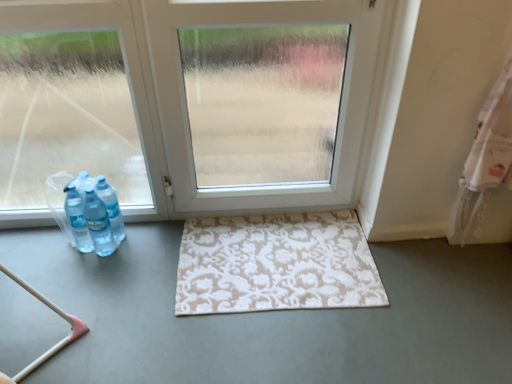
This screenshot has width=512, height=384. I want to click on vacant space to the right of beige patterned rug at center, so click(x=438, y=294).